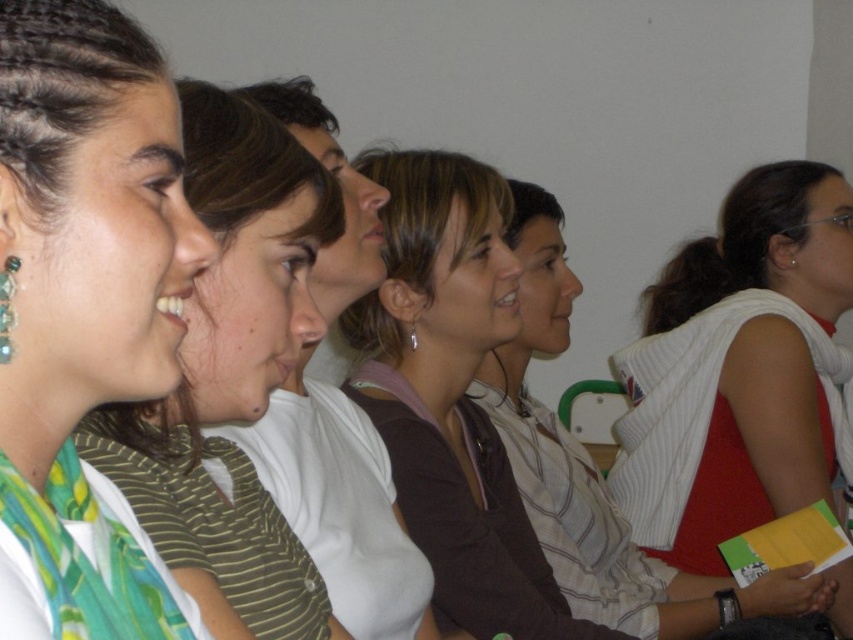
Can you confirm if green silk scarf at left is wider than green striped shirt at left?

No, green silk scarf at left is not wider than green striped shirt at left.

Is the position of green silk scarf at left less distant than that of green striped shirt at left?

Yes, it is.

Is point (62, 68) less distant than point (194, 378)?

That is True.

Locate an element on the screen. green silk scarf at left is located at coordinates (84, 310).

Does point (143, 344) come farther from viewer compared to point (479, 586)?

No, it is in front of (479, 586).

Can you confirm if green silk scarf at left is bigger than brown matte shirt at center?

Actually, green silk scarf at left might be smaller than brown matte shirt at center.

Measure the distance between green silk scarf at left and camera.

A distance of 18.41 inches exists between green silk scarf at left and camera.

You are a GUI agent. You are given a task and a screenshot of the screen. Output one action in this format:
    pyautogui.click(x=<x>, y=<y>)
    Task: Click on the green silk scarf at left
    The width and height of the screenshot is (853, 640).
    Given the screenshot: What is the action you would take?
    pyautogui.click(x=84, y=310)

Is point (47, 573) positioned before point (773, 404)?

Yes.

Is green silk scarf at left taller than white knit vest at center-right?

No.

The width and height of the screenshot is (853, 640). What do you see at coordinates (84, 310) in the screenshot? I see `green silk scarf at left` at bounding box center [84, 310].

Identify the location of green silk scarf at left. This screenshot has height=640, width=853. pyautogui.click(x=84, y=310).